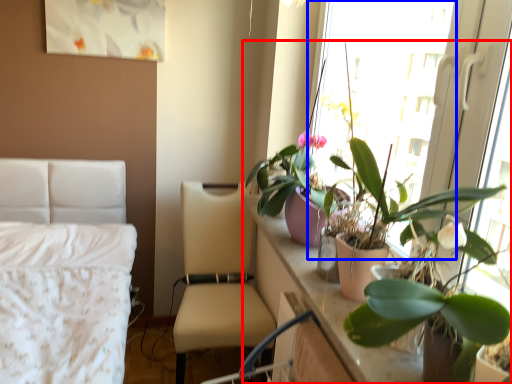
Question: Which object is closer to the camera taking this photo, houseplant (highlighted by a red box) or window screen (highlighted by a blue box)?

Choices:
 (A) houseplant
 (B) window screen

Answer: (A)